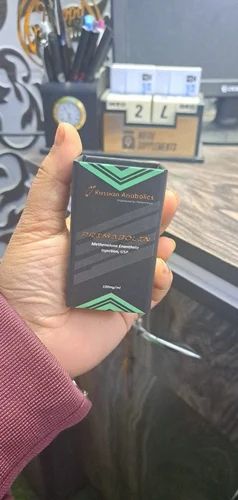
The height and width of the screenshot is (500, 238). I want to click on empty space on wooden table, so click(212, 204).